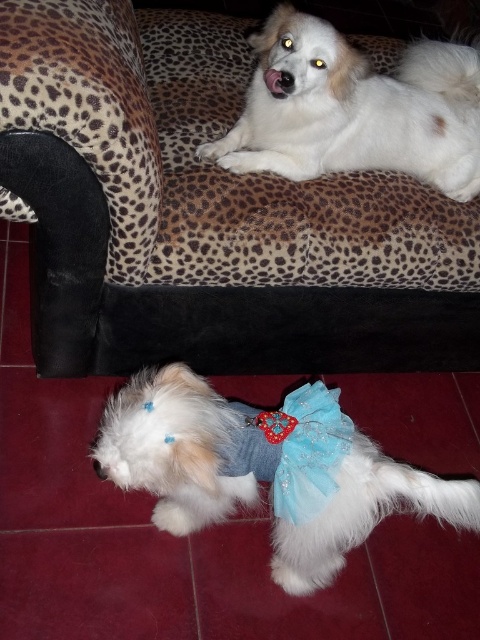
You are a pet sitter who needs to ensure there is enough space between the leopard print fabric couch at upper center and the white fluffy dog at lower center for a small toy. Is the current distance sufficient if the toy requires 15 inches of space?

The distance between the leopard print fabric couch at upper center and the white fluffy dog at lower center is 16.51 inches, which is more than the required 15 inches. Therefore, there is enough space for the small toy.

You are a photographer trying to capture a clear shot of the blue satin bow tie at lower center. However, the leopard print fabric couch at upper center is blocking your view. Can you move the couch to get a better angle? Explain why or why not based on their positions.

The leopard print fabric couch at upper center is positioned over the blue satin bow tie at lower center, meaning the couch is in front of the bow tie. Since the couch is blocking the view, you cannot see the bow tie without moving the couch. However, physically moving a couch might not be practical. Instead, you could adjust your camera angle by moving around the couch to find a vantage point where both the leopard print fabric couch at upper center and the blue satin bow tie at lower center are visible or